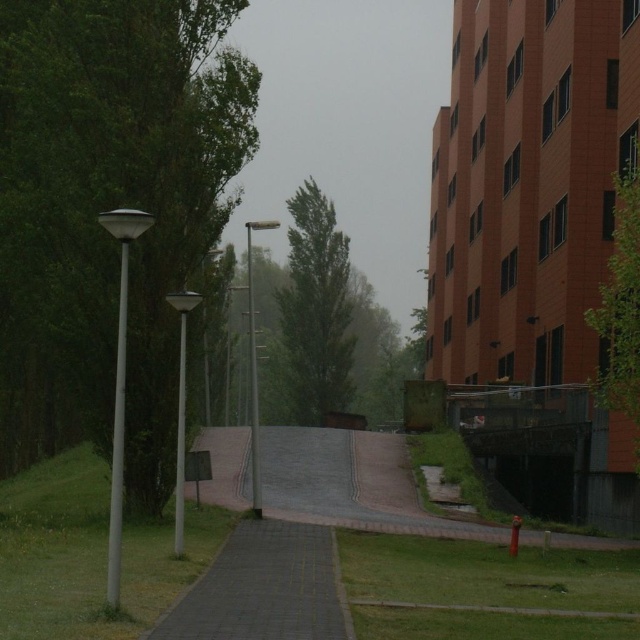
Is the position of green leafy tree at center more distant than that of green leafy tree at upper right?

Yes.

Between green leafy tree at center and green leafy tree at upper right, which one is positioned higher?

green leafy tree at center is above.

Between point (323, 307) and point (634, 384), which one is positioned in front?

Point (634, 384) is more forward.

The height and width of the screenshot is (640, 640). In order to click on green leafy tree at center in this screenshot , I will do `click(316, 308)`.

Between paved stone path at center and green leafy tree at upper right, which one is positioned higher?

green leafy tree at upper right is higher up.

Does paved stone path at center have a lesser height compared to green leafy tree at upper right?

Yes, paved stone path at center is shorter than green leafy tree at upper right.

Which is behind, point (237, 616) or point (627, 403)?

Point (627, 403)

Identify the location of paved stone path at center. The width and height of the screenshot is (640, 640). (262, 588).

Which of these two, green leafy tree at left or green leafy tree at center, stands taller?

Standing taller between the two is green leafy tree at center.

Which is in front, point (104, 10) or point (346, 316)?

Point (104, 10) is in front.

Where is `green leafy tree at left`? The height and width of the screenshot is (640, 640). green leafy tree at left is located at coordinates (118, 188).